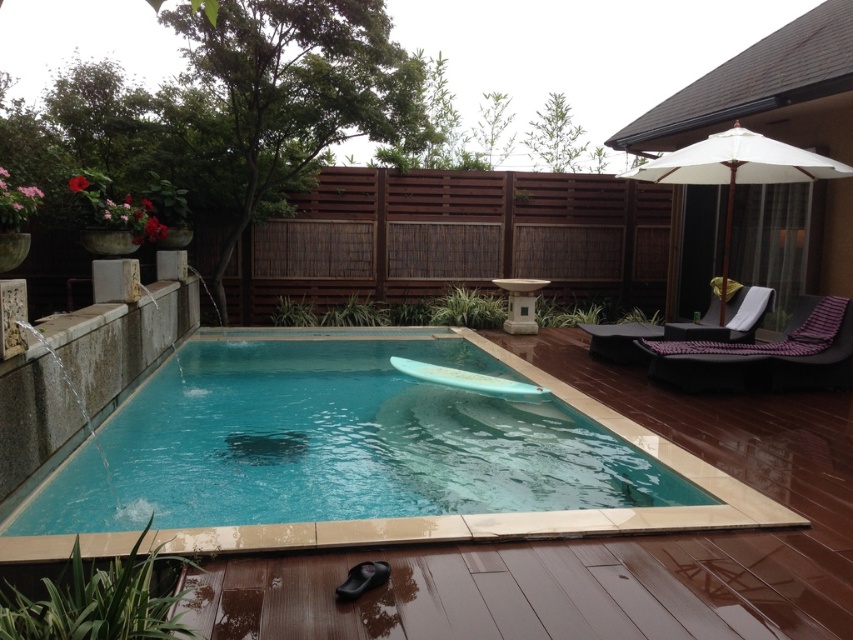
Question: Does blue glossy surfboard at center have a greater width compared to white fabric umbrella at upper right?

Choices:
 (A) yes
 (B) no

Answer: (A)

Question: Estimate the real-world distances between objects in this image. Which object is closer to the white fabric umbrella at upper right?

Choices:
 (A) purple fabric lounge chair at right
 (B) blue glossy surfboard at center

Answer: (A)

Question: Observing the image, what is the correct spatial positioning of purple fabric lounge chair at right in reference to black fabric lounge chair at upper right?

Choices:
 (A) right
 (B) left

Answer: (A)

Question: Which of the following is the closest to the observer?

Choices:
 (A) black fabric lounge chair at upper right
 (B) blue glossy surfboard at center
 (C) white fabric umbrella at upper right

Answer: (B)

Question: Can you confirm if purple fabric lounge chair at right is positioned above white fabric umbrella at upper right?

Choices:
 (A) yes
 (B) no

Answer: (B)

Question: Estimate the real-world distances between objects in this image. Which object is farther from the blue glossy surfboard at center?

Choices:
 (A) black fabric lounge chair at upper right
 (B) white fabric umbrella at upper right

Answer: (B)